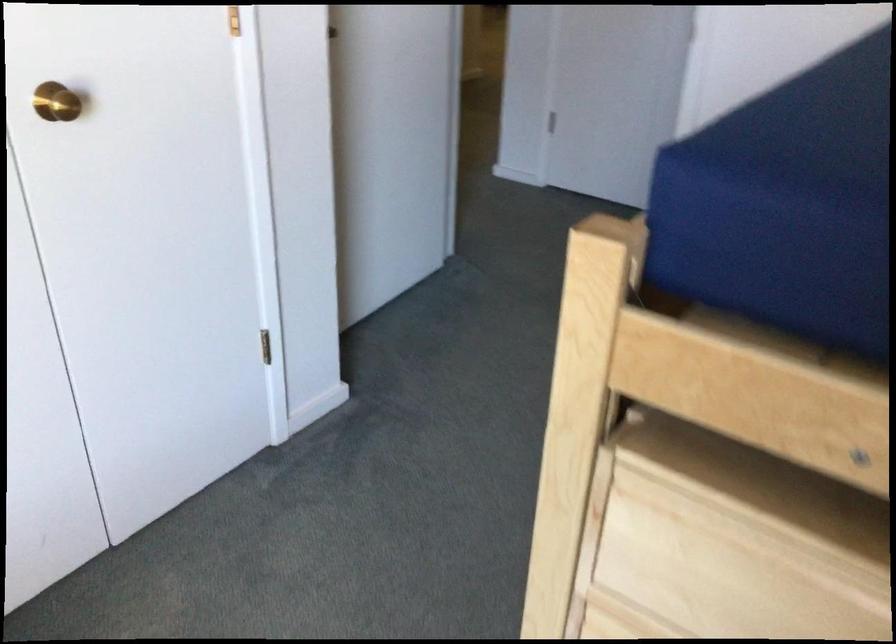
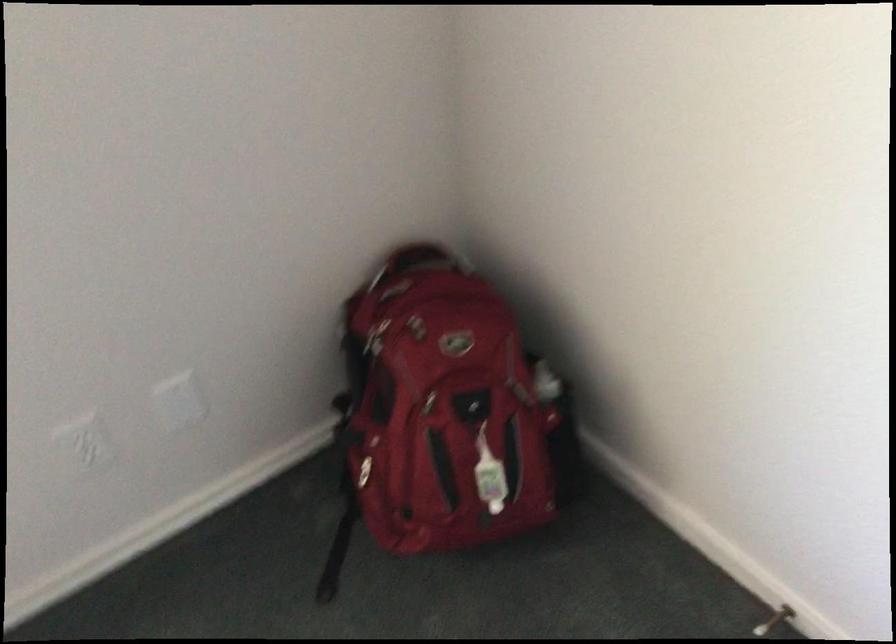
In the scene shown: The first image is from the beginning of the video and the second image is from the end. How did the camera likely rotate when shooting the video?

The camera rotated toward left-down.